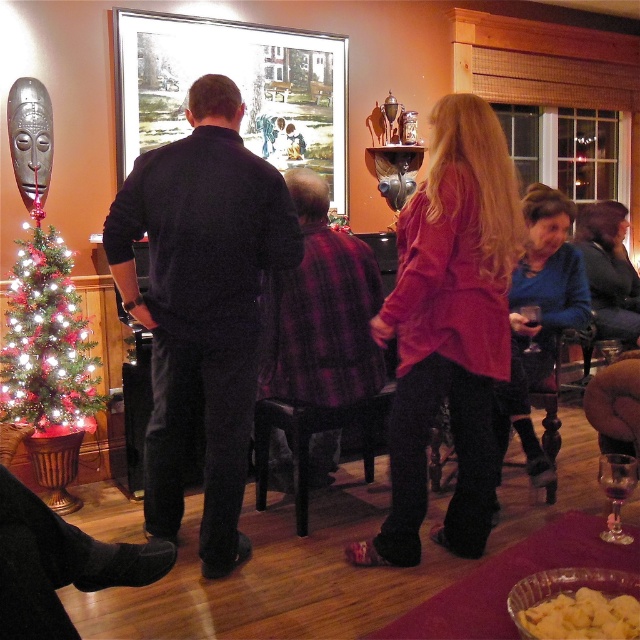
Question: Considering the relative positions of plaid fabric shirt at center and shiny red christmas tree at lower left in the image provided, where is plaid fabric shirt at center located with respect to shiny red christmas tree at lower left?

Choices:
 (A) left
 (B) right

Answer: (B)

Question: Which is nearer to the plaid fabric shirt at center?

Choices:
 (A) shiny red christmas tree at lower left
 (B) matte wooden picture frame at upper center
 (C) dark blue fabric shirt at center
 (D) transparent glass wine glass at lower right

Answer: (C)

Question: Among these points, which one is farthest from the camera?

Choices:
 (A) (234, 225)
 (B) (232, 72)
 (C) (339, 296)
 (D) (528, 349)

Answer: (B)

Question: Is plaid fabric shirt at center further to camera compared to shiny red christmas tree at lower left?

Choices:
 (A) no
 (B) yes

Answer: (A)

Question: Considering the real-world distances, which object is farthest from the dark blue fabric shirt at center?

Choices:
 (A) matte wooden picture frame at upper center
 (B) transparent glass at center
 (C) transparent glass wine glass at lower right
 (D) plaid fabric shirt at center

Answer: (A)

Question: Can you confirm if matte wooden picture frame at upper center is positioned to the right of transparent glass at center?

Choices:
 (A) no
 (B) yes

Answer: (A)